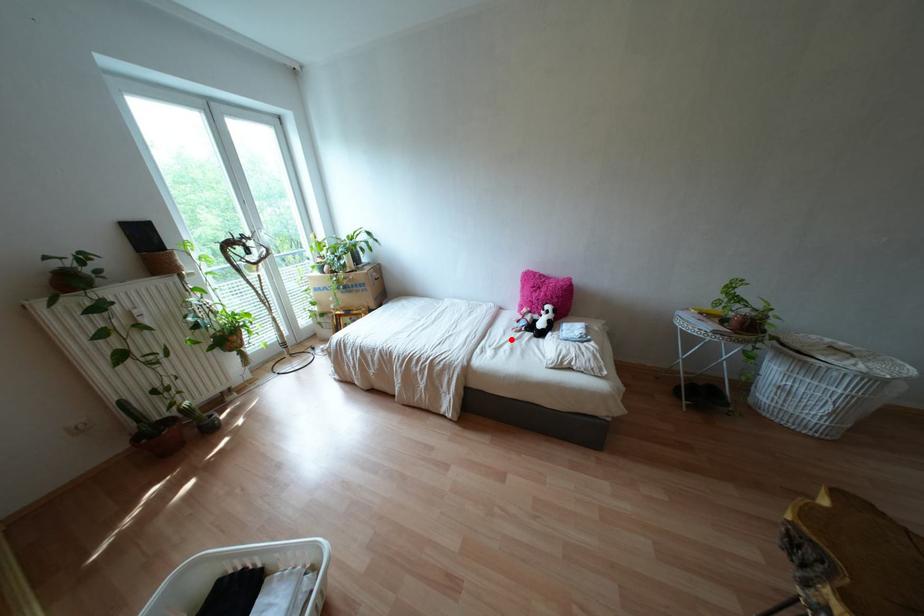
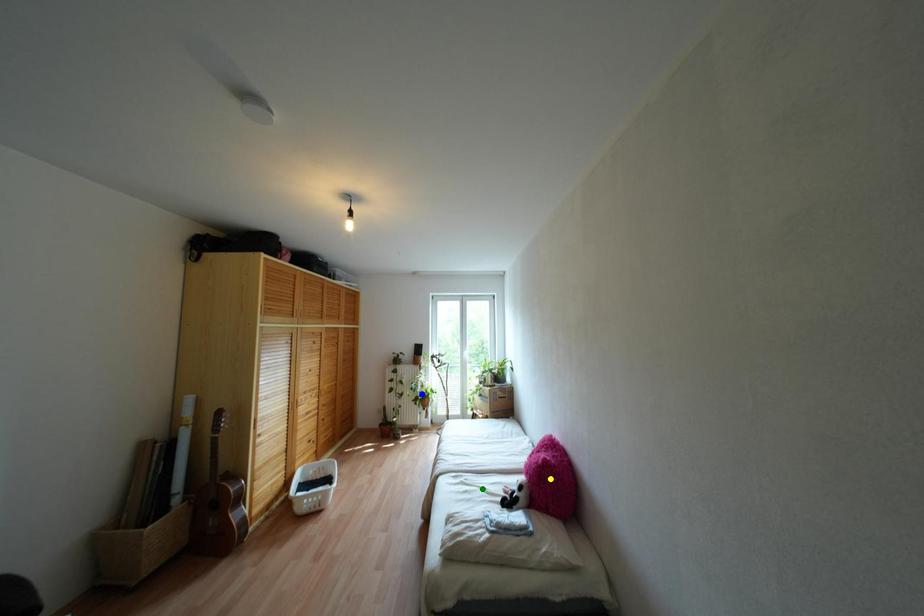
Question: I am providing you with two images of the same scene from different viewpoints. A red point is marked on the first image. You are given multiple points on the second image. Which point in image 2 represents the same 3d spot as the red point in image 1?

Choices:
 (A) blue point
 (B) green point
 (C) yellow point

Answer: (B)